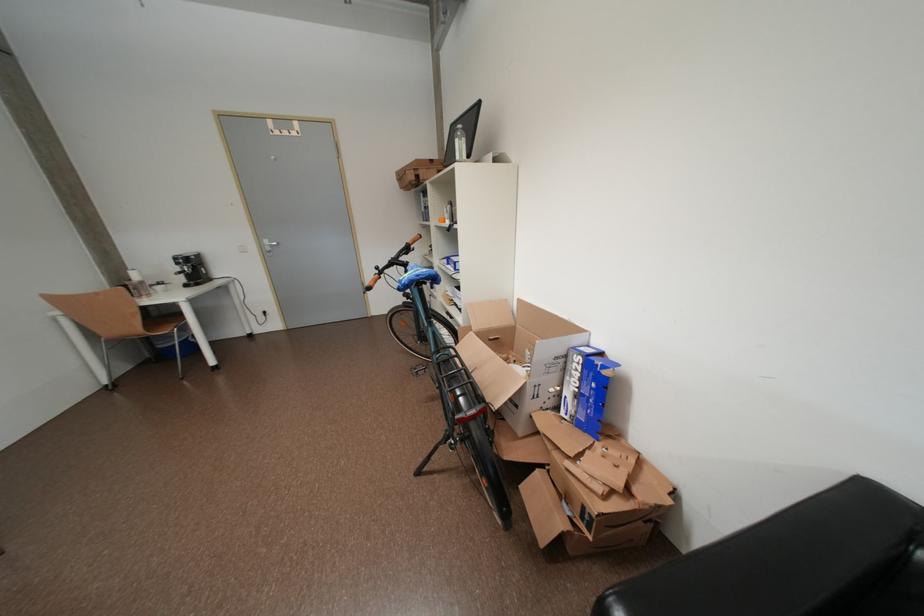
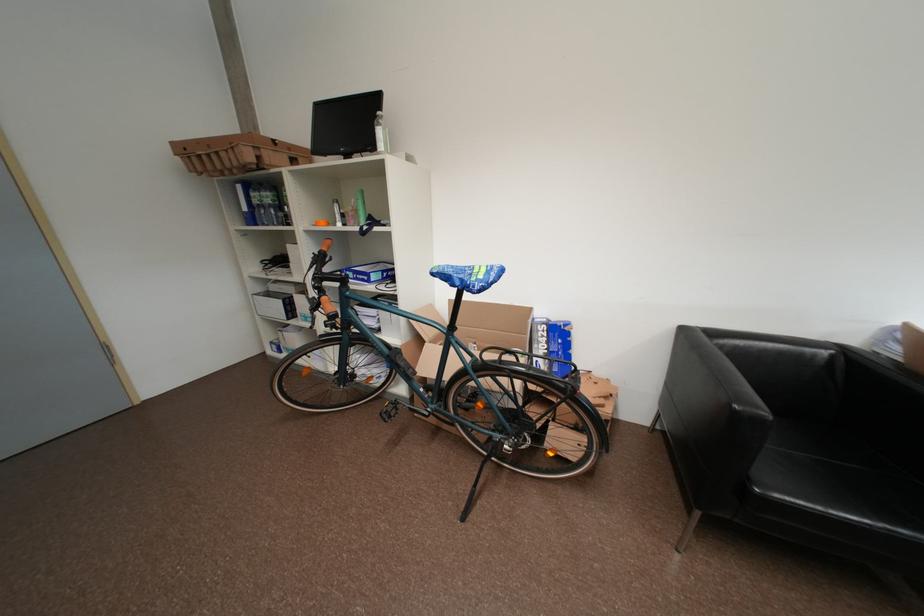
Find the pixel in the second image that matches pixel 588 361 in the first image.

(553, 329)